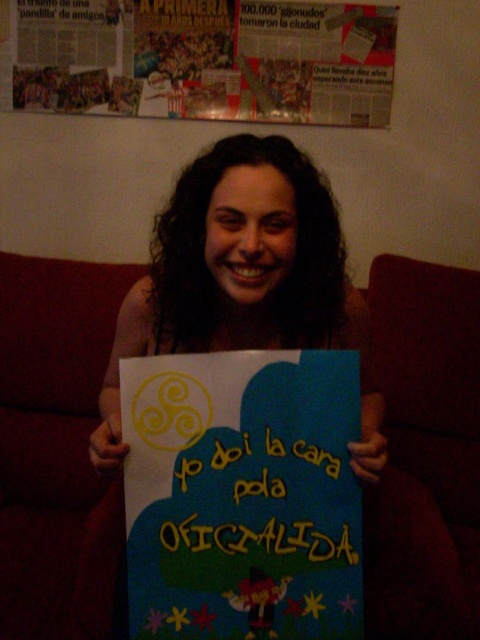
Between red fabric couch at center and matte paper poster at upper center, which one has less height?

matte paper poster at upper center is shorter.

Between red fabric couch at center and matte paper poster at upper center, which one appears on the left side from the viewer's perspective?

Positioned to the left is red fabric couch at center.

Which is in front, point (375, 310) or point (39, 3)?

Point (375, 310)

Where is `red fabric couch at center`? The height and width of the screenshot is (640, 480). red fabric couch at center is located at coordinates (425, 452).

Is red fabric couch at center thinner than blue paper poster at center?

Incorrect, red fabric couch at center's width is not less than blue paper poster at center's.

Is red fabric couch at center closer to camera compared to blue paper poster at center?

No.

Who is more forward, (x=16, y=488) or (x=275, y=436)?

Point (x=275, y=436) is more forward.

In order to click on red fabric couch at center in this screenshot , I will do `click(425, 452)`.

Who is taller, blue paper poster at center or matte paper poster at upper center?

Standing taller between the two is blue paper poster at center.

Can you confirm if blue paper poster at center is positioned to the right of matte paper poster at upper center?

Correct, you'll find blue paper poster at center to the right of matte paper poster at upper center.

Measure the distance between blue paper poster at center and camera.

They are 32.47 inches apart.

The image size is (480, 640). I want to click on blue paper poster at center, so click(x=242, y=496).